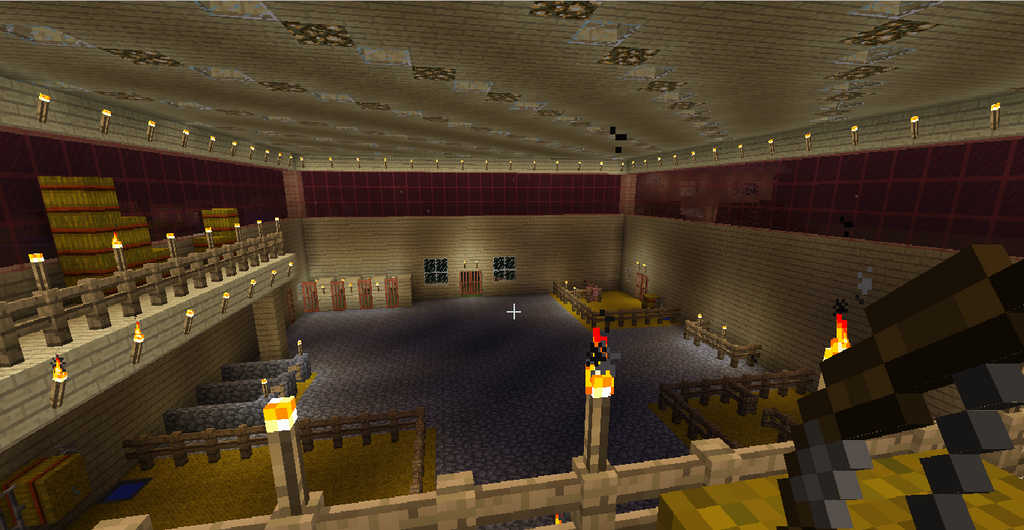
Where is `far wall`? Image resolution: width=1024 pixels, height=530 pixels. far wall is located at coordinates (475, 229).